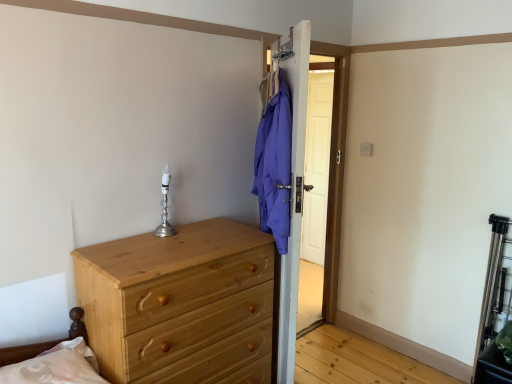
You are a GUI agent. You are given a task and a screenshot of the screen. Output one action in this format:
    pyautogui.click(x=<x>, y=<y>)
    Task: Click on the free space in front of silver metallic candle holder at center
    The image size is (512, 384).
    Given the screenshot: What is the action you would take?
    pyautogui.click(x=151, y=243)